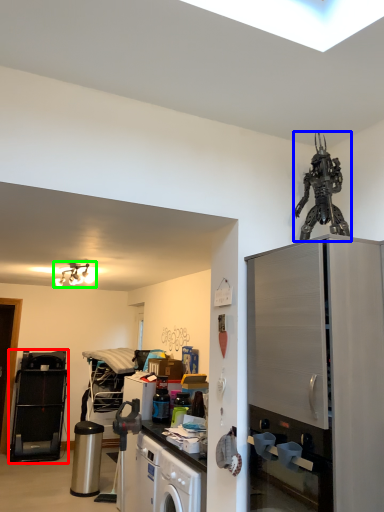
Question: Estimate the real-world distances between objects in this image. Which object is closer to appliance (highlighted by a red box), toy (highlighted by a blue box) or light fixture (highlighted by a green box)?

Choices:
 (A) toy
 (B) light fixture

Answer: (B)